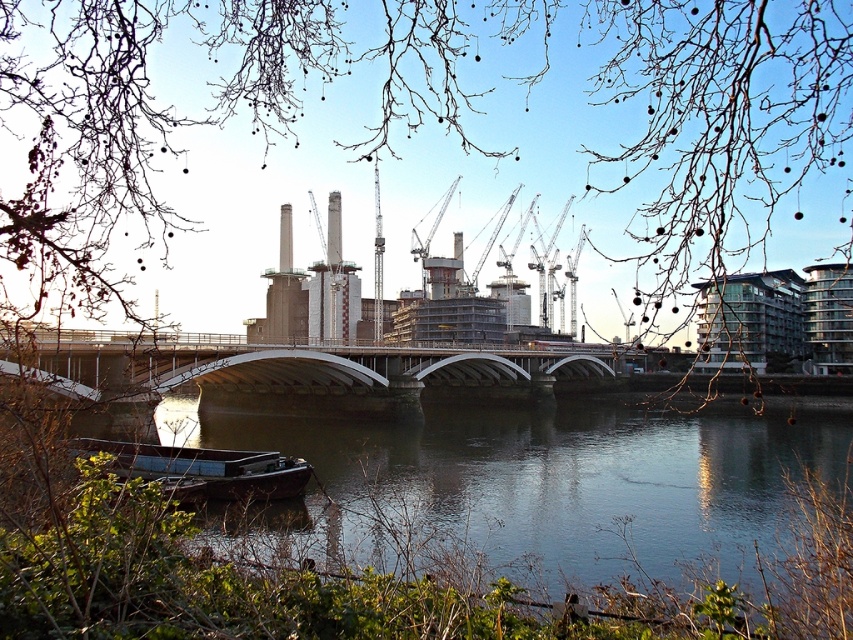
You are a kayaker planning to navigate through the riverside scene. You see the clear water at lower left and the wooden boat at lower left. Which object is closer to the river surface?

The clear water at lower left is positioned under the wooden boat at lower left, so the wooden boat at lower left is closer to the river surface.

You are standing at the riverside and want to determine which of the two points, point [560,360] or point [190,483], is closer to you. Which one would you say is nearer based on the scene?

Point [560,360] is closer to you because it is further to the viewer than point [190,483].

You are standing on the riverside and see the clear water at lower left and the wooden boat at lower left. Which object is located to the right when viewed from your perspective?

The clear water at lower left is positioned on the right side of wooden boat at lower left, so the clear water at lower left is located to the right of the wooden boat at lower left.